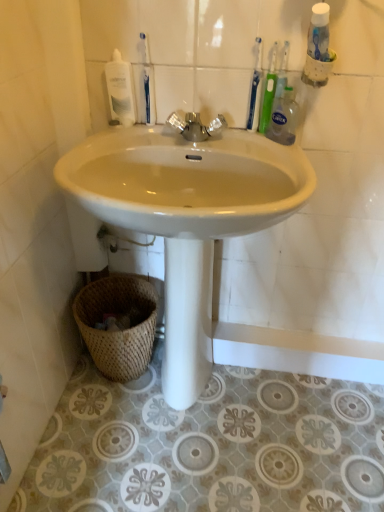
Image resolution: width=384 pixels, height=512 pixels. I want to click on vacant area situated to the left side of clear plastic bottle at upper right, so click(x=244, y=141).